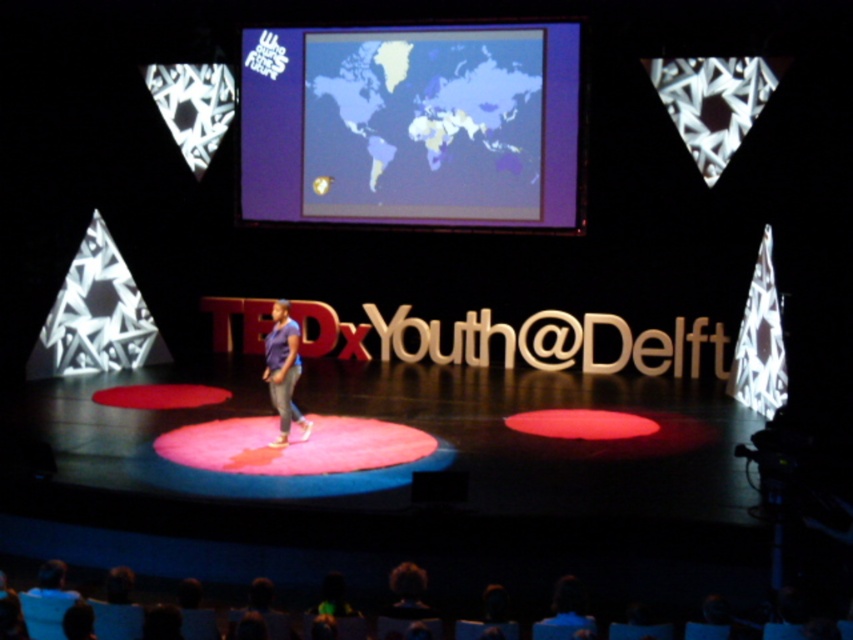
You are a photographer at the TEDxYouth event. You need to adjust your camera to focus on both the matte plastic map at upper center and the matte purple shirt at center. Which object should you focus on first if you want to capture both in the same frame?

The matte plastic map at upper center is to the right of matte purple shirt at center, so you should focus on the matte purple shirt at center first to ensure both are in the frame.

You are a photographer at the TEDxYouth event and need to capture a photo where both the matte plastic map at upper center and the matte purple shirt at center are visible. Which object should you focus on first to ensure both are in frame?

The matte plastic map at upper center is bigger than the matte purple shirt at center, so you should focus on the matte purple shirt at center first to ensure both fit within the frame.

You are an event organizer standing at point (287, 410) and want to move to the stage entrance located at point (426, 92). Is the stage entrance in front of or behind your current position?

The stage entrance at point (426, 92) is behind your current position at point (287, 410), so it is behind.